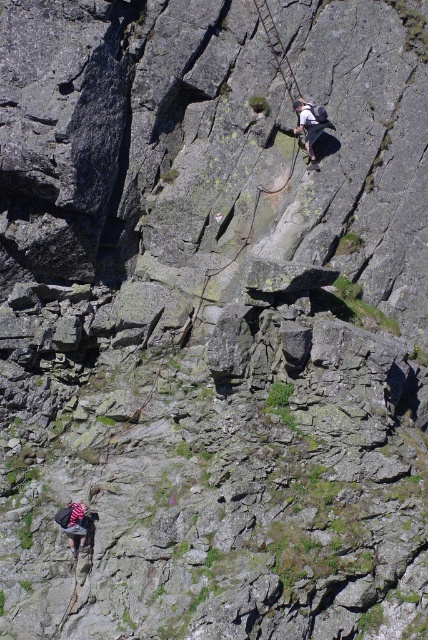
You are a hiker planning to ascend the mountain. You have both the matte gray climbing harness at upper center and the dark gray fabric backpack at lower left. Which item should you secure first if you need to prioritize the larger one?

You should secure the matte gray climbing harness at upper center first because it is larger than the dark gray fabric backpack at lower left.

Looking at this image, you are standing at the camera position and want to reach the point at coordinates point (317, 113). If you can walk at a speed of 3 feet per second, how long will it take you to reach that point?

The point at coordinates point (317, 113) is 73.70 feet away from the camera. At a walking speed of 3 feet per second, it would take approximately 24.57 seconds to reach the point.

You are a hiker preparing to ascend the mountain. You have a matte gray climbing harness at upper center and a dark gray fabric backpack at lower left. Which item should you adjust first if you need to ensure proper fit before starting the climb?

You should adjust the matte gray climbing harness at upper center first because its width is larger than the dark gray fabric backpack at lower left, making it more critical to ensure a secure fit for safety during the climb.